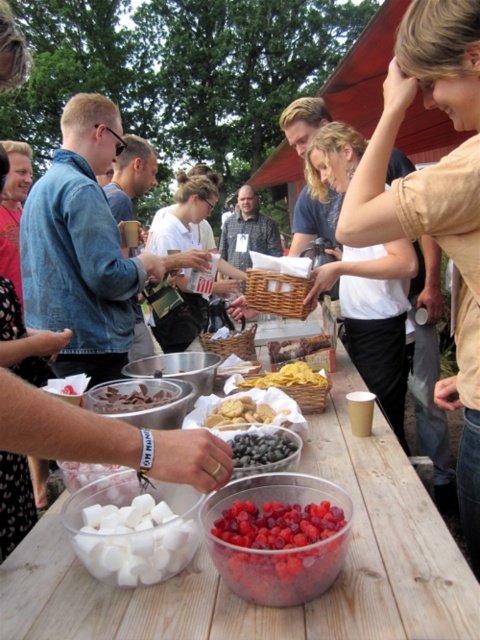
You are organizing a picnic and need to place a white matte shirt at center and shiny dark blue grapes at center on a small table. Which item should you place first to ensure both fit on the table?

The white matte shirt at center should be placed first because it might be wider than the shiny dark blue grapes at center, ensuring there is enough space for both items on the table.